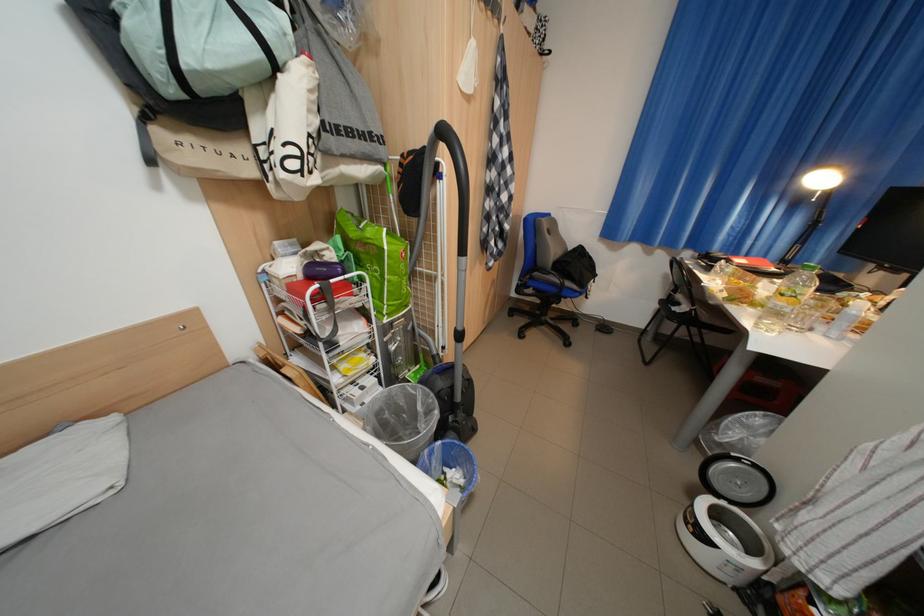
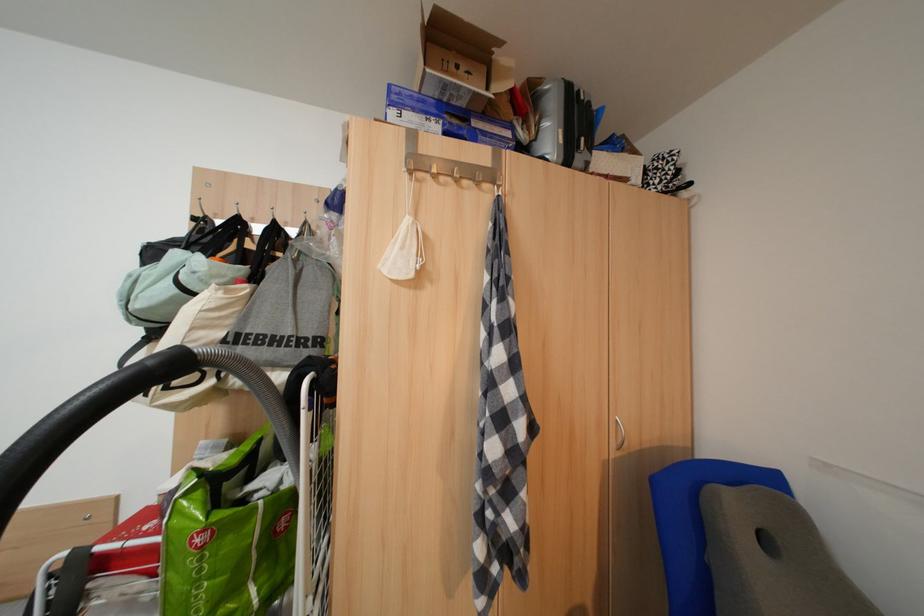
The point at (371, 140) is marked in the first image. Where is the corresponding point in the second image?

(282, 346)